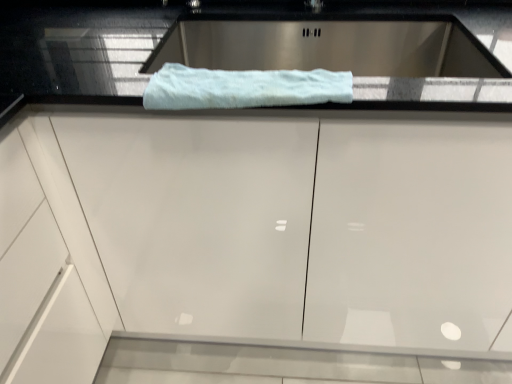
Question: Could you tell me if white glossy cabinet at center is facing white fluffy towel at center?

Choices:
 (A) yes
 (B) no

Answer: (B)

Question: From the image's perspective, is white glossy cabinet at center on top of white fluffy towel at center?

Choices:
 (A) yes
 (B) no

Answer: (B)

Question: Can you confirm if white glossy cabinet at center is smaller than white fluffy towel at center?

Choices:
 (A) yes
 (B) no

Answer: (B)

Question: From a real-world perspective, does white glossy cabinet at center sit lower than white fluffy towel at center?

Choices:
 (A) no
 (B) yes

Answer: (B)

Question: Are white glossy cabinet at center and white fluffy towel at center making contact?

Choices:
 (A) yes
 (B) no

Answer: (B)

Question: From a real-world perspective, does white glossy cabinet at center stand above white fluffy towel at center?

Choices:
 (A) yes
 (B) no

Answer: (B)

Question: Is white fluffy towel at center turned away from white glossy cabinet at center?

Choices:
 (A) yes
 (B) no

Answer: (A)

Question: Is white fluffy towel at center aimed at white glossy cabinet at center?

Choices:
 (A) yes
 (B) no

Answer: (A)

Question: Does white fluffy towel at center appear on the left side of white glossy cabinet at center?

Choices:
 (A) no
 (B) yes

Answer: (B)

Question: Does white fluffy towel at center have a lesser height compared to white glossy cabinet at center?

Choices:
 (A) yes
 (B) no

Answer: (A)

Question: From the image's perspective, is white fluffy towel at center above white glossy cabinet at center?

Choices:
 (A) no
 (B) yes

Answer: (B)

Question: Can you confirm if white fluffy towel at center is bigger than white glossy cabinet at center?

Choices:
 (A) yes
 (B) no

Answer: (B)

Question: From a real-world perspective, is white glossy cabinet at center positioned above or below white fluffy towel at center?

Choices:
 (A) below
 (B) above

Answer: (A)